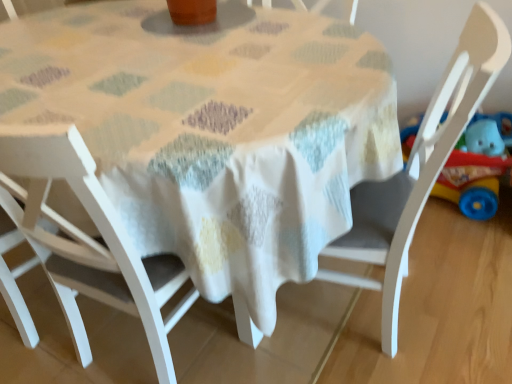
Question: Considering the relative sizes of white wood chair at center, the 1th chair positioned from the right, and white wood chair at lower left, which appears as the 3th chair when viewed from the right, in the image provided, is white wood chair at center, the 1th chair positioned from the right, shorter than white wood chair at lower left, which appears as the 3th chair when viewed from the right,?

Choices:
 (A) no
 (B) yes

Answer: (A)

Question: Is white wood chair at center, the 1th chair positioned from the right, aimed at white wood chair at lower left, the first chair from the left?

Choices:
 (A) no
 (B) yes

Answer: (A)

Question: Are white wood chair at center, the 1th chair positioned from the right, and white wood chair at lower left, the first chair from the left, beside each other?

Choices:
 (A) yes
 (B) no

Answer: (B)

Question: From a real-world perspective, is white wood chair at center, marked as the 3th chair in a left-to-right arrangement, on white wood chair at lower left, the first chair from the left?

Choices:
 (A) yes
 (B) no

Answer: (B)

Question: Does white wood chair at center, marked as the 3th chair in a left-to-right arrangement, have a greater width compared to white wood chair at lower left, which appears as the 3th chair when viewed from the right?

Choices:
 (A) no
 (B) yes

Answer: (B)

Question: Considering the positions of point (503, 62) and point (74, 170), is point (503, 62) closer or farther from the camera than point (74, 170)?

Choices:
 (A) closer
 (B) farther

Answer: (B)

Question: Looking at the image, does white wood chair at center, the 1th chair positioned from the right, seem bigger or smaller compared to white wood chair at center, marked as the 2th chair in a right-to-left arrangement?

Choices:
 (A) big
 (B) small

Answer: (A)

Question: Visually, is white wood chair at center, the 1th chair positioned from the right, positioned to the left or to the right of white wood chair at center, which ranks as the second chair in left-to-right order?

Choices:
 (A) left
 (B) right

Answer: (B)

Question: Looking at their shapes, would you say white wood chair at center, marked as the 3th chair in a left-to-right arrangement, is wider or thinner than white wood chair at center, marked as the 2th chair in a right-to-left arrangement?

Choices:
 (A) thin
 (B) wide

Answer: (B)

Question: Relative to white fabric table at center, is white wood chair at center, which ranks as the second chair in left-to-right order, in front or behind?

Choices:
 (A) behind
 (B) front

Answer: (B)

Question: Considering the positions of point (10, 150) and point (135, 13), is point (10, 150) closer or farther from the camera than point (135, 13)?

Choices:
 (A) farther
 (B) closer

Answer: (B)

Question: Is white wood chair at center, marked as the 2th chair in a right-to-left arrangement, wider or thinner than white fabric table at center?

Choices:
 (A) wide
 (B) thin

Answer: (B)

Question: Do you think white wood chair at center, which ranks as the second chair in left-to-right order, is within white fabric table at center, or outside of it?

Choices:
 (A) outside
 (B) inside

Answer: (B)

Question: Is point (449, 188) closer or farther from the camera than point (379, 251)?

Choices:
 (A) closer
 (B) farther

Answer: (B)

Question: Is rubberized plastic toy car at right spatially inside white wood chair at center, the 1th chair positioned from the right, or outside of it?

Choices:
 (A) outside
 (B) inside

Answer: (A)